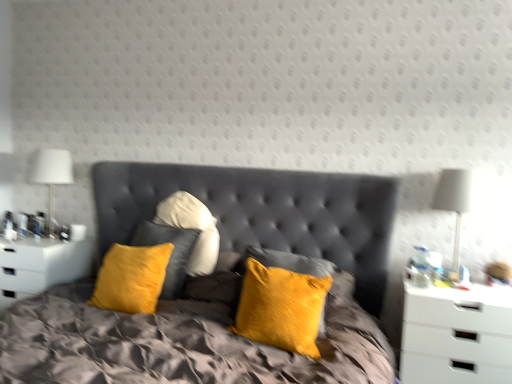
Measure the distance between point [308,323] and camera.

Point [308,323] and camera are 2.06 meters apart.

The width and height of the screenshot is (512, 384). In order to click on velvet yellow pillows at center in this screenshot , I will do `click(217, 284)`.

The image size is (512, 384). What do you see at coordinates (217, 284) in the screenshot?
I see `velvet yellow pillows at center` at bounding box center [217, 284].

What do you see at coordinates (40, 265) in the screenshot? I see `white glossy nightstand at left, the 2th nightstand in the right-to-left sequence` at bounding box center [40, 265].

Locate an element on the screen. The width and height of the screenshot is (512, 384). velvet yellow pillow at center is located at coordinates (281, 307).

Is white fabric lampshade at left, marked as the first bedside lamp in a left-to-right arrangement, at the back of white matte nightstand at right, the second nightstand when ordered from back to front?

No, white matte nightstand at right, the second nightstand when ordered from back to front, is not facing the opposite direction of white fabric lampshade at left, marked as the first bedside lamp in a left-to-right arrangement.

Considering the relative sizes of white matte nightstand at right, which is counted as the 2th nightstand, starting from the left, and white fabric lampshade at left, the second bedside lamp viewed from the front, in the image provided, is white matte nightstand at right, which is counted as the 2th nightstand, starting from the left, smaller than white fabric lampshade at left, the second bedside lamp viewed from the front,?

Incorrect, white matte nightstand at right, which is counted as the 2th nightstand, starting from the left, is not smaller in size than white fabric lampshade at left, the second bedside lamp viewed from the front.

Which is in front, point (484, 292) or point (63, 172)?

The point (484, 292) is more forward.

Considering their positions, is velvet yellow pillow at center located in front of or behind white glossy nightstand at left, marked as the first nightstand in a back-to-front arrangement?

Clearly, velvet yellow pillow at center is in front of white glossy nightstand at left, marked as the first nightstand in a back-to-front arrangement.

Is velvet yellow pillow at center to the right of white glossy nightstand at left, marked as the first nightstand in a back-to-front arrangement, from the viewer's perspective?

Yes.

Which is farther from the camera, [252,259] or [5,298]?

The point [5,298] is behind.

From the image's perspective, which is above, white glossy nightstand at left, the 1th nightstand viewed from the left, or white fabric lampshade at right, which is the 2th bedside lamp from left to right?

From the image's view, white fabric lampshade at right, which is the 2th bedside lamp from left to right, is above.

How different are the orientations of white glossy nightstand at left, marked as the first nightstand in a back-to-front arrangement, and white fabric lampshade at right, placed as the second bedside lamp when sorted from back to front, in degrees?

The facing directions of white glossy nightstand at left, marked as the first nightstand in a back-to-front arrangement, and white fabric lampshade at right, placed as the second bedside lamp when sorted from back to front, are 2.41 degrees apart.

Which is behind, point (26, 248) or point (470, 174)?

The point (26, 248) is behind.

Does white glossy nightstand at left, the second nightstand in the front-to-back sequence, have a lesser width compared to white fabric lampshade at right, which is the 2th bedside lamp from left to right?

In fact, white glossy nightstand at left, the second nightstand in the front-to-back sequence, might be wider than white fabric lampshade at right, which is the 2th bedside lamp from left to right.

In the scene shown: Can you confirm if white fabric lampshade at left, which ranks as the first bedside lamp in back-to-front order, is wider than white matte nightstand at right, the second nightstand when ordered from back to front?

In fact, white fabric lampshade at left, which ranks as the first bedside lamp in back-to-front order, might be narrower than white matte nightstand at right, the second nightstand when ordered from back to front.

From a real-world perspective, is white fabric lampshade at left, the second bedside lamp viewed from the front, positioned over white matte nightstand at right, placed as the 1th nightstand when sorted from right to left, based on gravity?

Yes, from a real-world perspective, white fabric lampshade at left, the second bedside lamp viewed from the front, is on top of white matte nightstand at right, placed as the 1th nightstand when sorted from right to left.

Does point (52, 183) come closer to viewer compared to point (413, 292)?

No, it is behind (413, 292).

What's the angular difference between white fabric lampshade at left, positioned as the second bedside lamp in right-to-left order, and white matte nightstand at right, placed as the 1th nightstand when sorted from right to left,'s facing directions?

3.41 degrees.

Is point (302, 307) farther from camera compared to point (246, 226)?

No, it is not.

Does velvet yellow pillow at center have a lesser width compared to velvet yellow pillows at center?

Indeed, velvet yellow pillow at center has a lesser width compared to velvet yellow pillows at center.

From the image's perspective, is velvet yellow pillow at center beneath velvet yellow pillows at center?

Correct, velvet yellow pillow at center appears lower than velvet yellow pillows at center in the image.

Which is less distant, (68, 266) or (477, 299)?

The point (477, 299) is more forward.

Considering the relative sizes of white glossy nightstand at left, the 2th nightstand in the right-to-left sequence, and white matte nightstand at right, acting as the 1th nightstand starting from the front, in the image provided, is white glossy nightstand at left, the 2th nightstand in the right-to-left sequence, shorter than white matte nightstand at right, acting as the 1th nightstand starting from the front,?

Yes.

Is white glossy nightstand at left, the second nightstand in the front-to-back sequence, to the left or to the right of white matte nightstand at right, placed as the 1th nightstand when sorted from right to left, in the image?

white glossy nightstand at left, the second nightstand in the front-to-back sequence, is positioned on white matte nightstand at right, placed as the 1th nightstand when sorted from right to left,'s left side.

Relative to white matte nightstand at right, the second nightstand when ordered from back to front, is white glossy nightstand at left, the 1th nightstand viewed from the left, in front or behind?

Clearly, white glossy nightstand at left, the 1th nightstand viewed from the left, is behind white matte nightstand at right, the second nightstand when ordered from back to front.

In the scene shown: Is velvet yellow pillows at center oriented towards velvet yellow pillow at center?

No, velvet yellow pillows at center does not turn towards velvet yellow pillow at center.

Relative to velvet yellow pillow at center, is velvet yellow pillows at center in front or behind?

In the image, velvet yellow pillows at center appears in front of velvet yellow pillow at center.

Can you see velvet yellow pillows at center touching velvet yellow pillow at center?

No, velvet yellow pillows at center is not in contact with velvet yellow pillow at center.

What are the coordinates of `the 2nd bedside lamp located above the white matte nightstand at right, the second nightstand when ordered from back to front (from a real-world perspective)` in the screenshot? It's located at (52, 175).

You are a GUI agent. You are given a task and a screenshot of the screen. Output one action in this format:
    pyautogui.click(x=<x>, y=<y>)
    Task: Click on the 1st nightstand positioned below the velvet yellow pillow at center (from a real-world perspective)
    The width and height of the screenshot is (512, 384).
    Given the screenshot: What is the action you would take?
    pyautogui.click(x=40, y=265)

Considering their positions, is white fabric lampshade at right, placed as the second bedside lamp when sorted from back to front, positioned further to velvet yellow pillows at center than white glossy nightstand at left, the 2th nightstand in the right-to-left sequence?

white fabric lampshade at right, placed as the second bedside lamp when sorted from back to front, is positioned further to the anchor velvet yellow pillows at center.

Considering their positions, is white fabric lampshade at right, which is the 2th bedside lamp from left to right, positioned closer to white fabric lampshade at left, positioned as the second bedside lamp in right-to-left order, than white glossy nightstand at left, the second nightstand in the front-to-back sequence?

white glossy nightstand at left, the second nightstand in the front-to-back sequence, lies closer to white fabric lampshade at left, positioned as the second bedside lamp in right-to-left order, than the other object.

From the image, which object appears to be nearer to velvet yellow pillow at center, velvet yellow pillows at center or white fabric lampshade at left, which ranks as the first bedside lamp in back-to-front order?

velvet yellow pillows at center is positioned closer to the anchor velvet yellow pillow at center.

Based on their spatial positions, is white matte nightstand at right, acting as the 1th nightstand starting from the front, or white fabric lampshade at right, positioned as the first bedside lamp in right-to-left order, further from white fabric lampshade at left, marked as the first bedside lamp in a left-to-right arrangement?

white matte nightstand at right, acting as the 1th nightstand starting from the front.

Consider the image. From the image, which object appears to be nearer to white fabric lampshade at right, which is the 2th bedside lamp from left to right, white glossy nightstand at left, the second nightstand in the front-to-back sequence, or white matte nightstand at right, acting as the 1th nightstand starting from the front?

Based on the image, white matte nightstand at right, acting as the 1th nightstand starting from the front, appears to be nearer to white fabric lampshade at right, which is the 2th bedside lamp from left to right.

From the picture: Based on their spatial positions, is white fabric lampshade at left, marked as the first bedside lamp in a left-to-right arrangement, or white matte nightstand at right, placed as the 1th nightstand when sorted from right to left, further from velvet yellow pillow at center?

The object further to velvet yellow pillow at center is white fabric lampshade at left, marked as the first bedside lamp in a left-to-right arrangement.

When comparing their distances from velvet yellow pillow at center, does white fabric lampshade at left, which ranks as the first bedside lamp in back-to-front order, or velvet yellow pillows at center seem closer?

Based on the image, velvet yellow pillows at center appears to be nearer to velvet yellow pillow at center.

Looking at the image, which one is located closer to white fabric lampshade at left, marked as the first bedside lamp in a left-to-right arrangement, white fabric lampshade at right, which is the 2th bedside lamp from left to right, or white matte nightstand at right, acting as the 1th nightstand starting from the front?

Based on the image, white fabric lampshade at right, which is the 2th bedside lamp from left to right, appears to be nearer to white fabric lampshade at left, marked as the first bedside lamp in a left-to-right arrangement.

Image resolution: width=512 pixels, height=384 pixels. In order to click on nightstand between velvet yellow pillows at center and white fabric lampshade at right, which is the 2th bedside lamp from left to right, in the front-back direction in this screenshot , I will do `click(457, 335)`.

Locate an element on the screen. The width and height of the screenshot is (512, 384). pillow between white fabric lampshade at left, marked as the first bedside lamp in a left-to-right arrangement, and white fabric lampshade at right, positioned as the first bedside lamp in front-to-back order is located at coordinates (281, 307).

Find the location of a particular element. This screenshot has width=512, height=384. bed located between white fabric lampshade at left, the second bedside lamp viewed from the front, and white fabric lampshade at right, which is the 2th bedside lamp from left to right, in the left-right direction is located at coordinates (217, 284).

This screenshot has width=512, height=384. I want to click on nightstand located between white fabric lampshade at left, positioned as the second bedside lamp in right-to-left order, and white fabric lampshade at right, which is the 2th bedside lamp from left to right, in the left-right direction, so click(457, 335).